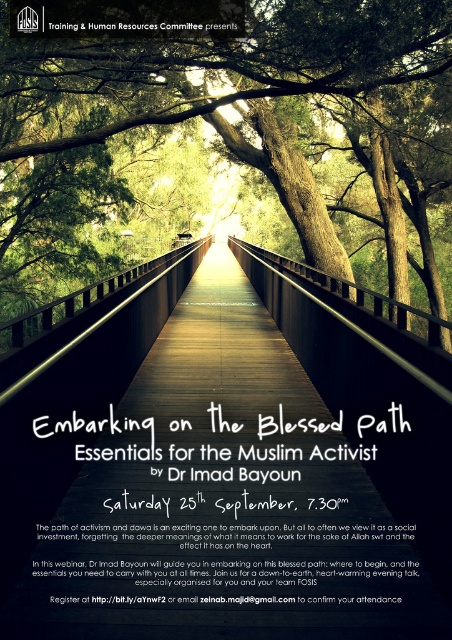
Does wooden bridge at center have a smaller size compared to green wood bridge at center?

Correct, wooden bridge at center occupies less space than green wood bridge at center.

Which is more to the right, wooden bridge at center or green wood bridge at center?

green wood bridge at center

This screenshot has height=640, width=452. I want to click on wooden bridge at center, so click(x=224, y=477).

This screenshot has height=640, width=452. In order to click on wooden bridge at center in this screenshot , I will do `click(224, 477)`.